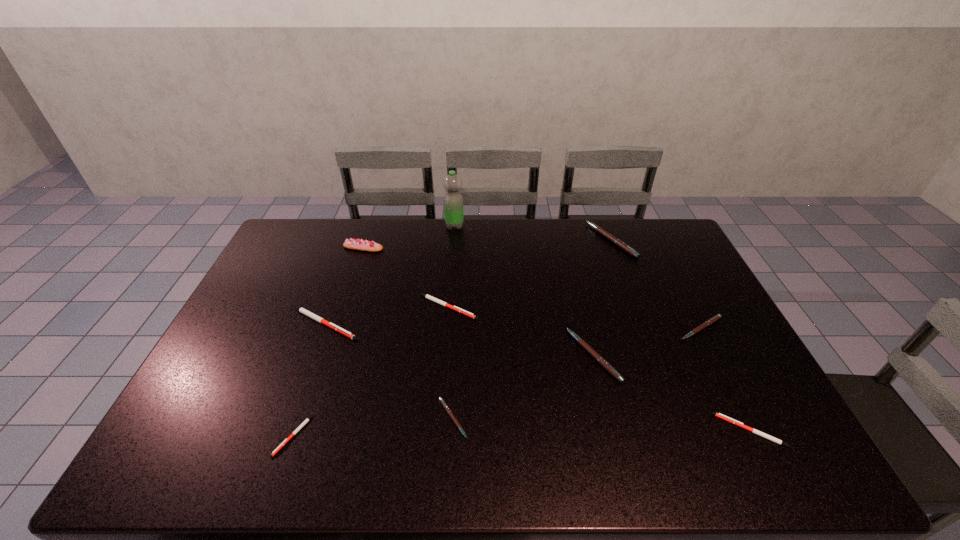
At what (x,y) coordinates should I click in order to perform the action: click on water bottle that is at the far edge. Please return your answer as a coordinate pair (x, y). This screenshot has height=540, width=960. Looking at the image, I should click on (453, 201).

Locate an element on the screen. The width and height of the screenshot is (960, 540). eclair present at the far edge is located at coordinates (357, 244).

Where is `pen that is at the far edge`? This screenshot has height=540, width=960. pen that is at the far edge is located at coordinates (619, 243).

Locate an element on the screen. object present at the left edge is located at coordinates (302, 310).

Locate an element on the screen. The width and height of the screenshot is (960, 540). object at the near right corner is located at coordinates (728, 419).

In order to click on vacant area at the far edge in this screenshot , I will do `click(386, 227)`.

Identify the location of free space at the near edge. (622, 442).

This screenshot has width=960, height=540. What are the coordinates of `vacant space at the left edge` in the screenshot? It's located at (227, 353).

In the image, there is a desktop. Identify the location of vacant space at the right edge. This screenshot has width=960, height=540. (652, 273).

Identify the location of vacant space at the far right corner of the desktop. (645, 238).